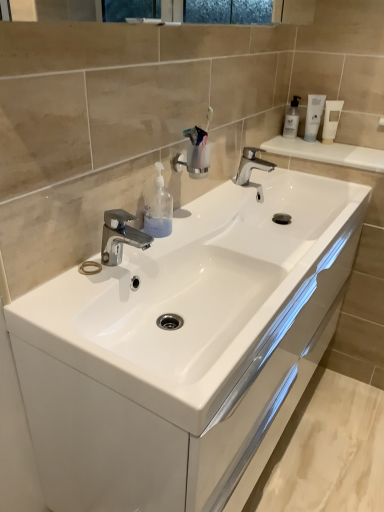
Question: Considering the positions of point (x=160, y=309) and point (x=329, y=136), is point (x=160, y=309) closer or farther from the camera than point (x=329, y=136)?

Choices:
 (A) farther
 (B) closer

Answer: (B)

Question: Is white glossy cabinet at center inside or outside of white glossy tube at upper right, which ranks as the 3th mouthwash in left-to-right order?

Choices:
 (A) inside
 (B) outside

Answer: (B)

Question: Considering the real-world distances, which object is farthest from the chrome metallic faucet at upper center, which is counted as the 1th tap, starting from the right?

Choices:
 (A) white glossy mouthwash at upper right, the second mouthwash when ordered from left to right
 (B) white glossy tube at upper right, the first mouthwash from the right
 (C) transparent plastic mouthwash at upper right, which ranks as the 1th mouthwash in left-to-right order
 (D) transparent plastic soap dispenser at center
 (E) polished chrome faucet at center, acting as the second tap starting from the back

Answer: (E)

Question: Which is nearer to the chrome metallic faucet at upper center, marked as the 2th tap in a bottom-to-top arrangement?

Choices:
 (A) white glossy mouthwash at upper right, the 2th mouthwash positioned from the right
 (B) white glossy tube at upper right, the first mouthwash from the right
 (C) white glossy cabinet at center
 (D) transparent plastic mouthwash at upper right, which ranks as the 1th mouthwash in left-to-right order
 (E) polished chrome faucet at center, the 1th tap viewed from the front

Answer: (D)